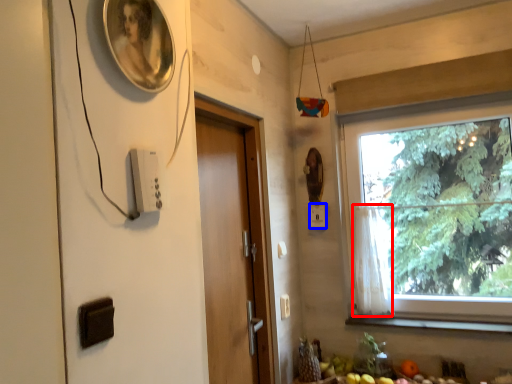
Question: Which object is closer to the camera taking this photo, curtain (highlighted by a red box) or light switch (highlighted by a blue box)?

Choices:
 (A) curtain
 (B) light switch

Answer: (A)